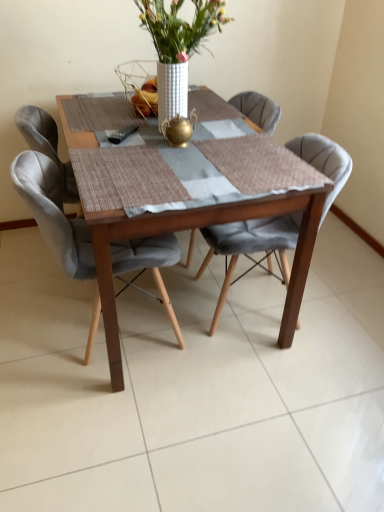
At what (x,y) coordinates should I click in order to perform the action: click on empty space that is ontop of velvet grey chair at center, the 1th chair viewed from the right. Please return your answer as a coordinate pair (x, y). The image size is (384, 512). Looking at the image, I should click on point(250,153).